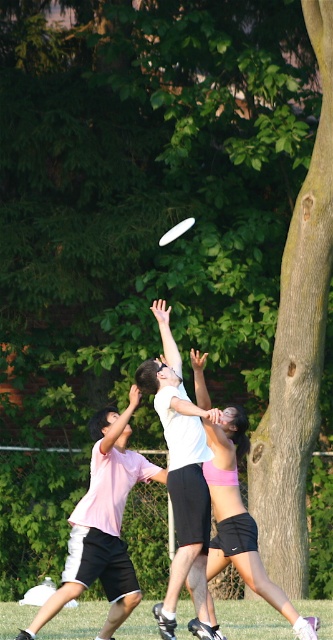
Based on the photo, does white matte shirt at center appear under pink fabric shorts at center?

Actually, white matte shirt at center is above pink fabric shorts at center.

Which is more to the left, white matte shirt at center or pink fabric shorts at center?

Positioned to the left is white matte shirt at center.

Locate an element on the screen. The width and height of the screenshot is (333, 640). white matte shirt at center is located at coordinates (181, 477).

Is white matte shirt at center further to camera compared to white plastic frisbee at upper center?

No, it is not.

Who is lower down, white matte shirt at center or white plastic frisbee at upper center?

white matte shirt at center is lower down.

Who is more forward, (201, 556) or (187, 224)?

Point (201, 556) is more forward.

Locate an element on the screen. The image size is (333, 640). white matte shirt at center is located at coordinates (181, 477).

Can you confirm if pink matte shirt at center is taller than white plastic frisbee at upper center?

Yes.

Does pink matte shirt at center have a smaller size compared to white plastic frisbee at upper center?

No, pink matte shirt at center is not smaller than white plastic frisbee at upper center.

Image resolution: width=333 pixels, height=640 pixels. What do you see at coordinates (102, 524) in the screenshot?
I see `pink matte shirt at center` at bounding box center [102, 524].

Locate an element on the screen. pink matte shirt at center is located at coordinates (102, 524).